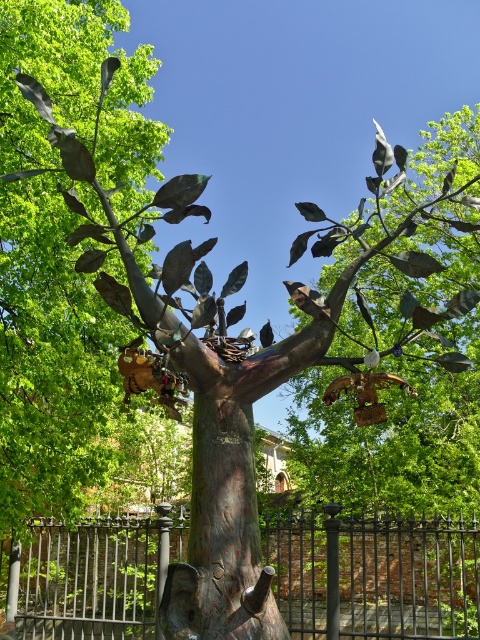
Question: Is black wrought iron fence at lower center smaller than rustic wood tree trunk at center?

Choices:
 (A) no
 (B) yes

Answer: (B)

Question: From the image, what is the correct spatial relationship of black wrought iron fence at lower center in relation to rustic wood tree trunk at center?

Choices:
 (A) above
 (B) below

Answer: (B)

Question: Can you confirm if black wrought iron fence at lower center is smaller than rustic wood tree trunk at center?

Choices:
 (A) no
 (B) yes

Answer: (B)

Question: Which of the following is the farthest from the observer?

Choices:
 (A) rustic wood tree trunk at center
 (B) black wrought iron fence at lower center

Answer: (B)

Question: Which point is closer to the camera?

Choices:
 (A) black wrought iron fence at lower center
 (B) rustic wood tree trunk at center

Answer: (B)